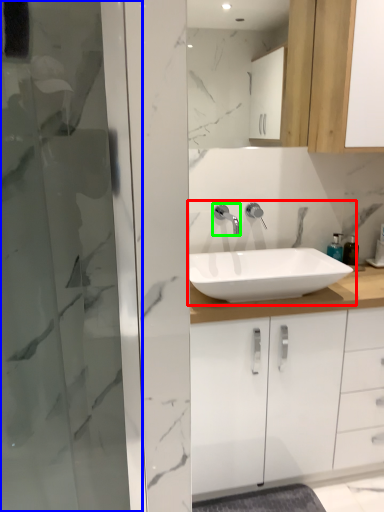
Question: Considering the real-world distances, which object is closest to sink (highlighted by a red box)? screen door (highlighted by a blue box) or tap (highlighted by a green box).

Choices:
 (A) screen door
 (B) tap

Answer: (B)